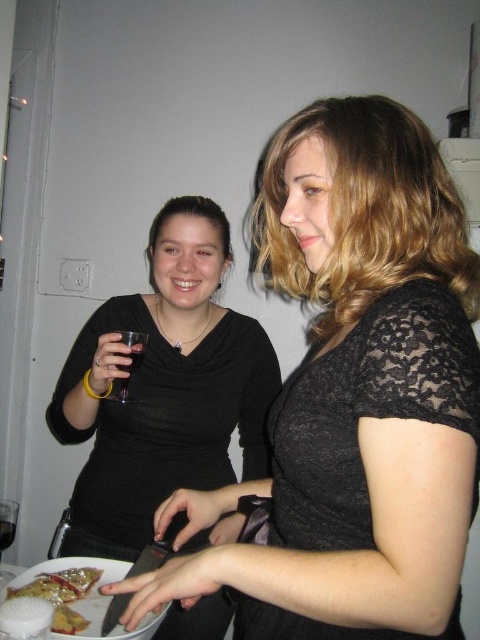
The width and height of the screenshot is (480, 640). I want to click on matte black shirt at center, so click(x=164, y=388).

Looking at this image, is matte black shirt at center bigger than transparent glass at upper left?

Yes, matte black shirt at center is bigger than transparent glass at upper left.

Between point (197, 372) and point (132, 360), which one is positioned in front?

Positioned in front is point (132, 360).

Where is `matte black shirt at center`? This screenshot has width=480, height=640. matte black shirt at center is located at coordinates (164, 388).

Find the location of a particular element. This screenshot has height=640, width=480. clear plastic cup at upper left is located at coordinates pyautogui.click(x=128, y=365).

Based on the photo, can you confirm if clear plastic cup at upper left is thinner than clear glass wine at lower left?

Yes, clear plastic cup at upper left is thinner than clear glass wine at lower left.

Is point (139, 362) positioned after point (0, 552)?

No, (139, 362) is in front of (0, 552).

The width and height of the screenshot is (480, 640). I want to click on clear plastic cup at upper left, so click(x=128, y=365).

Can you confirm if black lace shirt at center is positioned above matte black shirt at center?

Indeed, black lace shirt at center is positioned over matte black shirt at center.

Is black lace shirt at center taller than matte black shirt at center?

No, black lace shirt at center is not taller than matte black shirt at center.

Locate an element on the screen. black lace shirt at center is located at coordinates (354, 396).